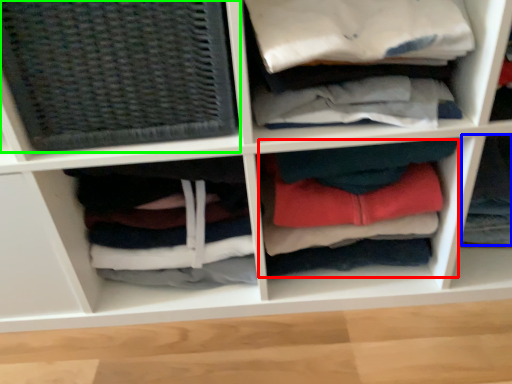
Question: Which is farther away from clothing (highlighted by a red box)? clothing (highlighted by a blue box) or basket (highlighted by a green box)?

Choices:
 (A) clothing
 (B) basket

Answer: (B)